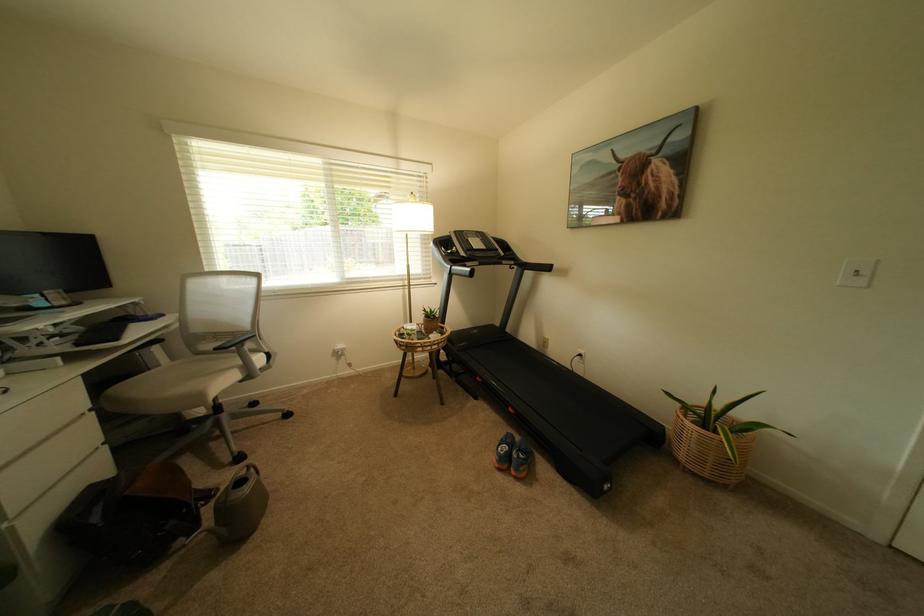
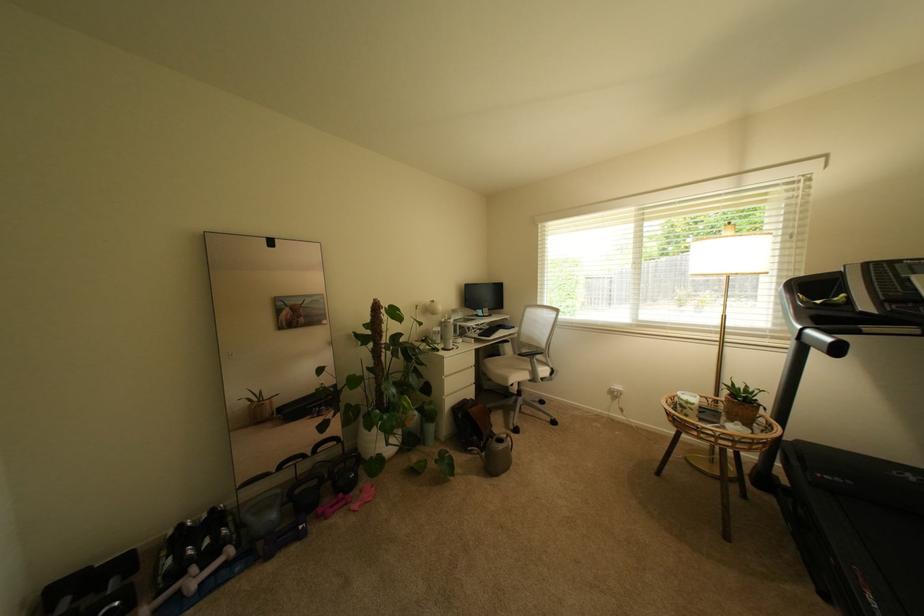
Locate, in the second image, the point that corresponds to (457,253) in the first image.

(827, 302)